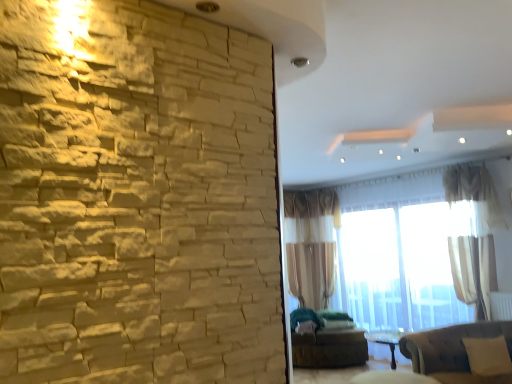
Question: Can you confirm if white sheer curtain at upper right, marked as the 1th curtain in a right-to-left arrangement, is wider than beige fabric pillow at lower right?

Choices:
 (A) yes
 (B) no

Answer: (A)

Question: Can you confirm if white sheer curtain at upper right, marked as the 2th curtain in a back-to-front arrangement, is positioned to the left of beige fabric pillow at lower right?

Choices:
 (A) no
 (B) yes

Answer: (A)

Question: Considering the relative sizes of white sheer curtain at upper right, marked as the 2th curtain in a left-to-right arrangement, and beige fabric pillow at lower right in the image provided, is white sheer curtain at upper right, marked as the 2th curtain in a left-to-right arrangement, bigger than beige fabric pillow at lower right?

Choices:
 (A) no
 (B) yes

Answer: (B)

Question: Does white sheer curtain at upper right, marked as the 2th curtain in a left-to-right arrangement, turn towards beige fabric pillow at lower right?

Choices:
 (A) no
 (B) yes

Answer: (B)

Question: Does white sheer curtain at upper right, marked as the 1th curtain in a front-to-back arrangement, have a greater height compared to beige fabric pillow at lower right?

Choices:
 (A) yes
 (B) no

Answer: (A)

Question: Is white sheer curtain at upper right, marked as the 1th curtain in a right-to-left arrangement, shorter than beige fabric pillow at lower right?

Choices:
 (A) yes
 (B) no

Answer: (B)

Question: Is sheer beige curtain at center, the 1th curtain positioned from the left, completely or partially outside of white plastic radiator at lower right?

Choices:
 (A) yes
 (B) no

Answer: (A)

Question: From the image's perspective, would you say sheer beige curtain at center, the 1th curtain positioned from the left, is positioned over white plastic radiator at lower right?

Choices:
 (A) yes
 (B) no

Answer: (A)

Question: Is sheer beige curtain at center, which appears as the 2th curtain when viewed from the right, next to white plastic radiator at lower right?

Choices:
 (A) yes
 (B) no

Answer: (B)

Question: Can you confirm if sheer beige curtain at center, which ranks as the 1th curtain in back-to-front order, is bigger than white plastic radiator at lower right?

Choices:
 (A) yes
 (B) no

Answer: (A)

Question: From the image's perspective, is sheer beige curtain at center, the 1th curtain positioned from the left, below white plastic radiator at lower right?

Choices:
 (A) yes
 (B) no

Answer: (B)

Question: Considering the relative sizes of sheer beige curtain at center, the 1th curtain positioned from the left, and white plastic radiator at lower right in the image provided, is sheer beige curtain at center, the 1th curtain positioned from the left, smaller than white plastic radiator at lower right?

Choices:
 (A) yes
 (B) no

Answer: (B)

Question: Does beige fabric pillow at lower right turn towards sheer beige curtain at center, the 2th curtain in the front-to-back sequence?

Choices:
 (A) yes
 (B) no

Answer: (B)